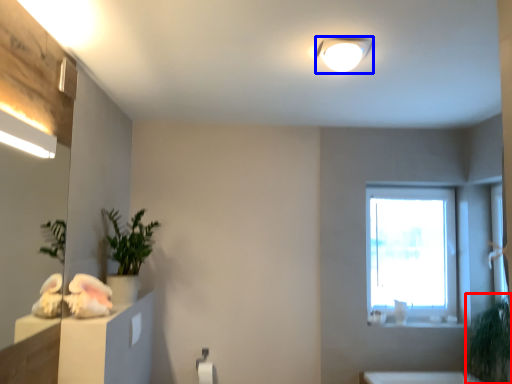
Question: Which of the following is the closest to the observer, plant (highlighted by a red box) or light fixture (highlighted by a blue box)?

Choices:
 (A) plant
 (B) light fixture

Answer: (B)